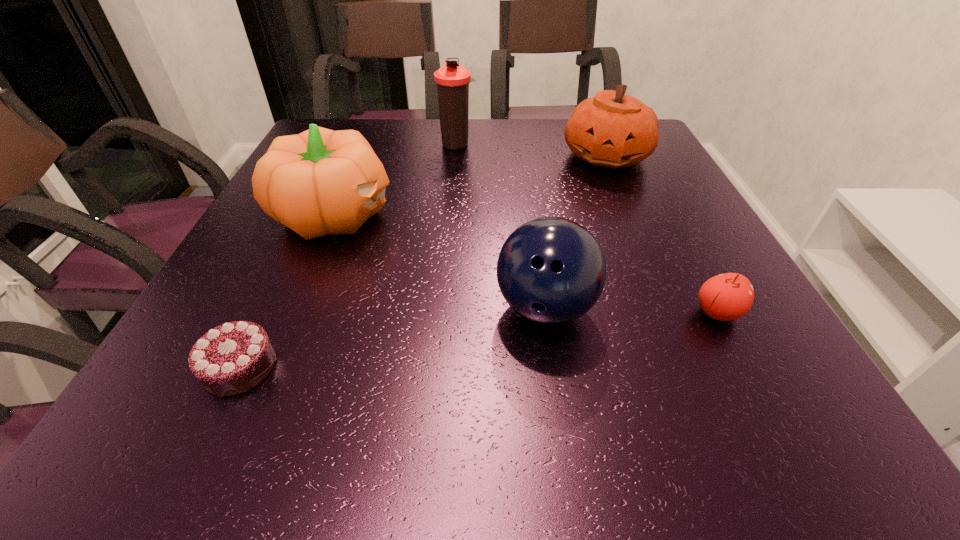
At what (x,y) coordinates should I click in order to perform the action: click on vacant area that lies between the fourth object from left to right and the third farthest object. Please return your answer as a coordinate pair (x, y). Image resolution: width=960 pixels, height=540 pixels. Looking at the image, I should click on (440, 261).

Identify the location of vacant area that lies between the fourth nearest object and the fourth object from right to left. This screenshot has width=960, height=540. (396, 179).

Find the location of a particular element. The height and width of the screenshot is (540, 960). free space between the chocolate cake and the thermos bottle is located at coordinates [348, 255].

Identify the location of vacant space in between the fourth object from right to left and the right pumpkin. The image size is (960, 540). (532, 150).

The height and width of the screenshot is (540, 960). What are the coordinates of `the closest object to the nearer pumpkin` in the screenshot? It's located at (452, 81).

Locate which object ranks fifth in proximity to the left pumpkin. Please provide its 2D coordinates. Your answer should be formatted as a tuple, i.e. [(x, y)], where the tuple contains the x and y coordinates of a point satisfying the conditions above.

[(726, 297)]

At what (x,y) coordinates should I click in order to perform the action: click on free space that satisfies the following two spatial constraints: 1. on the carved face of the second shortest object; 2. on the left side of the nearer pumpkin. Please return your answer as a coordinate pair (x, y). Looking at the image, I should click on (295, 312).

Locate an element on the screen. free region that satisfies the following two spatial constraints: 1. on the front-facing side of the right pumpkin; 2. on the carved face of the third farthest object is located at coordinates (632, 214).